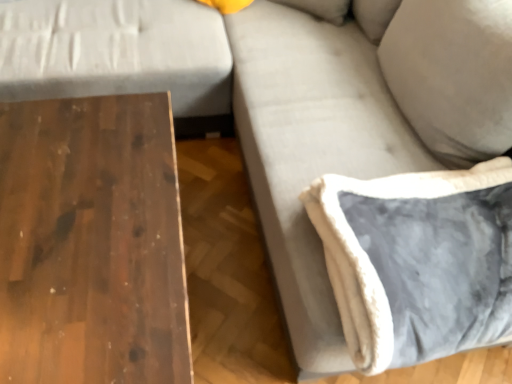
Question: Considering the relative sizes of dark wood table at left and velvet gray pillow at lower right in the image provided, is dark wood table at left wider than velvet gray pillow at lower right?

Choices:
 (A) no
 (B) yes

Answer: (B)

Question: From a real-world perspective, is dark wood table at left physically above velvet gray pillow at lower right?

Choices:
 (A) no
 (B) yes

Answer: (A)

Question: Can you see dark wood table at left touching velvet gray pillow at lower right?

Choices:
 (A) yes
 (B) no

Answer: (B)

Question: Is dark wood table at left looking in the opposite direction of velvet gray pillow at lower right?

Choices:
 (A) no
 (B) yes

Answer: (A)

Question: From a real-world perspective, does dark wood table at left sit lower than velvet gray pillow at lower right?

Choices:
 (A) yes
 (B) no

Answer: (A)

Question: Considering the relative sizes of dark wood table at left and velvet gray pillow at lower right in the image provided, is dark wood table at left shorter than velvet gray pillow at lower right?

Choices:
 (A) yes
 (B) no

Answer: (B)

Question: Can we say velvet gray pillow at lower right lies outside dark wood table at left?

Choices:
 (A) yes
 (B) no

Answer: (A)

Question: Is velvet gray pillow at lower right to the left of dark wood table at left from the viewer's perspective?

Choices:
 (A) yes
 (B) no

Answer: (B)

Question: From the image's perspective, does velvet gray pillow at lower right appear higher than dark wood table at left?

Choices:
 (A) yes
 (B) no

Answer: (A)

Question: From a real-world perspective, is velvet gray pillow at lower right physically above dark wood table at left?

Choices:
 (A) no
 (B) yes

Answer: (B)

Question: From the image's perspective, is velvet gray pillow at lower right under dark wood table at left?

Choices:
 (A) yes
 (B) no

Answer: (B)

Question: Is velvet gray pillow at lower right oriented away from dark wood table at left?

Choices:
 (A) no
 (B) yes

Answer: (A)

Question: From the image's perspective, is velvet gray pillow at lower right positioned above or below dark wood table at left?

Choices:
 (A) above
 (B) below

Answer: (A)